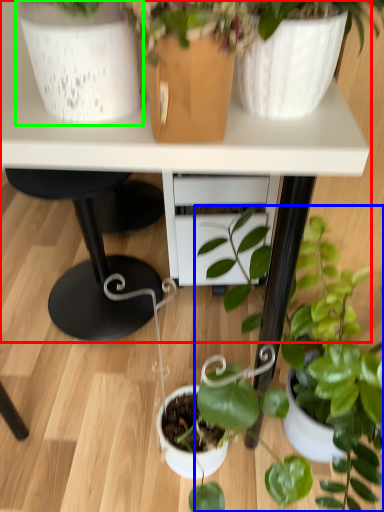
Question: Considering the real-world distances, which object is closest to table (highlighted by a red box)? houseplant (highlighted by a blue box) or flowerpot (highlighted by a green box).

Choices:
 (A) houseplant
 (B) flowerpot

Answer: (B)